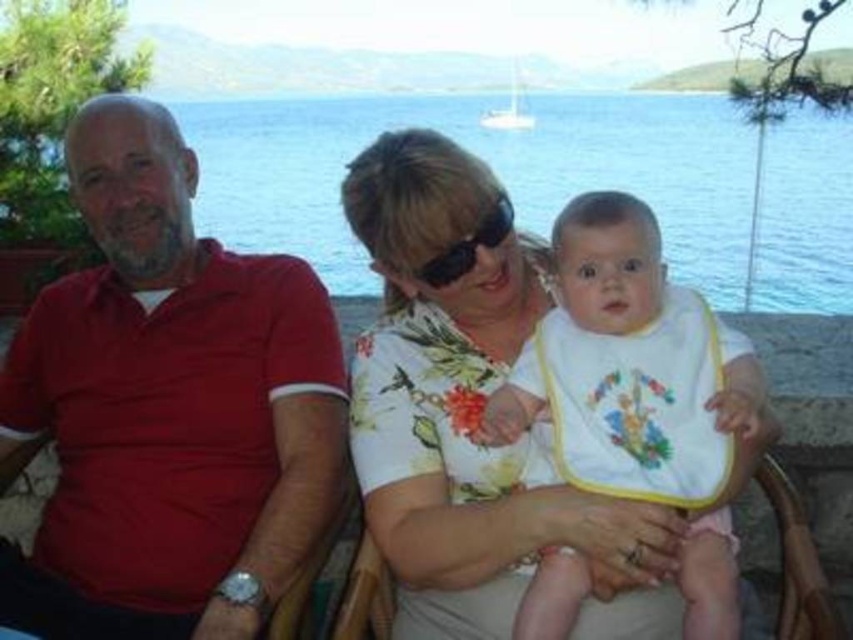
You are a photographer trying to capture a photo of the blue water at center and the white cotton bib at center. Which object should you focus on if you want to ensure the larger subject is in sharp focus?

The blue water at center is larger in size than the white cotton bib at center, so you should focus on the blue water at center to ensure the larger subject is in sharp focus.

You are standing at the point with coordinates point (416, 124) and want to walk to the point (653, 241). Which direction should you move in?

To move from point (416, 124) to point (653, 241), you should move forward since point (416, 124) is behind point (653, 241).

You are a photographer taking a picture of the family. The matte red polo shirt at left and the white cotton bib at center are both in your frame. Which object is closer to the camera?

The matte red polo shirt at left is closer to the camera because it is further to the viewer than the white cotton bib at center.